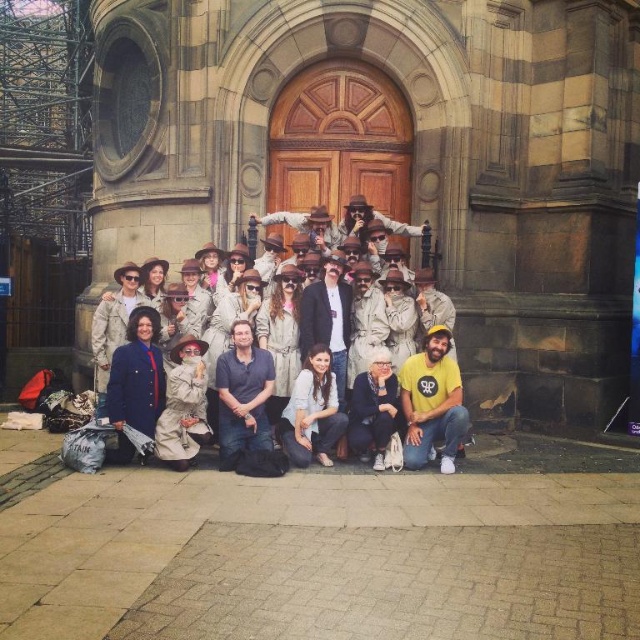
You are a photographer trying to adjust the focus on your camera to capture both the dark blue shirt at center and the smooth beige coat at center clearly. Which object should you focus on first to ensure proper depth of field?

The dark blue shirt at center is smaller than the smooth beige coat at center, so you should focus on the dark blue shirt at center first to ensure proper depth of field.

You are standing in front of the stone building and want to take a photo. You notice two points marked as point 1 at coordinates (237, 400) and point 2 at coordinates (342, 298). Which point is closer to you?

Point 1 at coordinates (237, 400) is closer to you than point 2 at coordinates (342, 298).